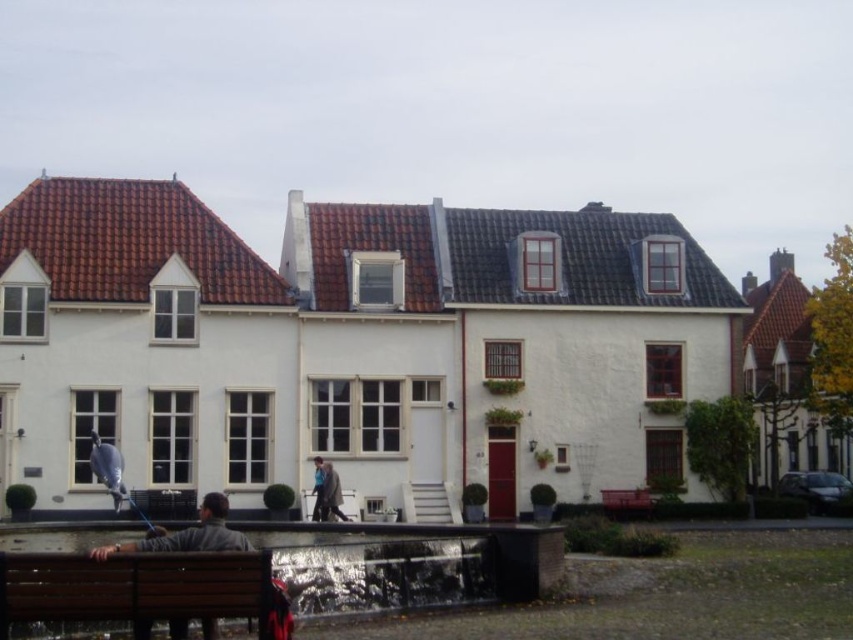
Question: Which of the following is the farthest from the observer?

Choices:
 (A) (231, 577)
 (B) (225, 536)

Answer: (B)

Question: Can you confirm if red wooden bench at lower right is thinner than blue denim jacket at center?

Choices:
 (A) yes
 (B) no

Answer: (B)

Question: Does wooden bench at lower left appear over red wooden bench at lower right?

Choices:
 (A) no
 (B) yes

Answer: (B)

Question: Which of these objects is positioned closest to the blue denim jacket at center?

Choices:
 (A) wooden bench at lower left
 (B) red wooden bench at lower right
 (C) brown wooden bench at lower left

Answer: (A)

Question: Which point appears closest to the camera in this image?

Choices:
 (A) (178, 624)
 (B) (331, 502)
 (C) (154, 596)
 (D) (618, 508)

Answer: (C)

Question: Is red wooden bench at lower right below blue fabric jacket at center?

Choices:
 (A) no
 (B) yes

Answer: (B)